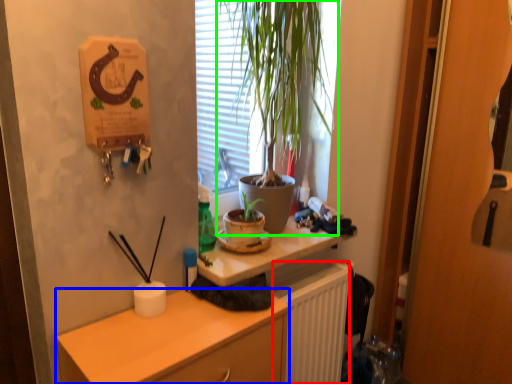
Question: Which object is positioned farthest from radiator (highlighted by a red box)? Select from cabinetry (highlighted by a blue box) and houseplant (highlighted by a green box).

Choices:
 (A) cabinetry
 (B) houseplant

Answer: (B)